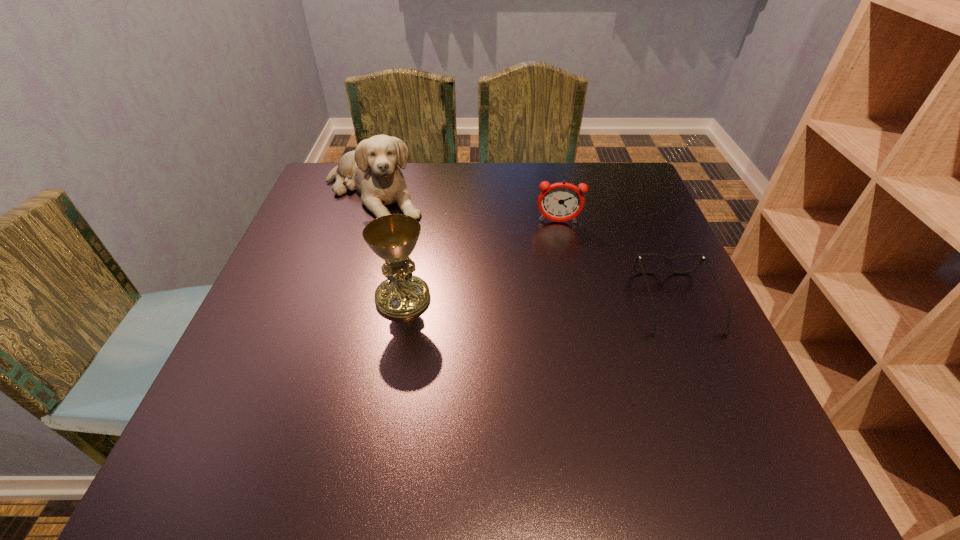
The height and width of the screenshot is (540, 960). I want to click on free space located 0.280m on the front-facing side of the second shortest object, so click(561, 310).

Identify the location of free space located 0.110m on the front-facing side of the puppy. The height and width of the screenshot is (540, 960). (429, 240).

In order to click on vacant space located on the front-facing side of the puppy in this screenshot , I will do `click(462, 266)`.

I want to click on free space located on the front-facing side of the puppy, so click(x=456, y=261).

What are the coordinates of `object located at the far edge` in the screenshot? It's located at (373, 168).

Locate an element on the screen. The height and width of the screenshot is (540, 960). object that is at the left edge is located at coordinates (373, 168).

Where is `object located at the right edge`? The image size is (960, 540). object located at the right edge is located at coordinates (669, 260).

At what (x,y) coordinates should I click in order to perform the action: click on object present at the far left corner. Please return your answer as a coordinate pair (x, y). The height and width of the screenshot is (540, 960). Looking at the image, I should click on (373, 168).

Locate an element on the screen. free space at the far edge of the desktop is located at coordinates (492, 206).

At what (x,y) coordinates should I click in order to perform the action: click on free location at the near edge. Please return your answer as a coordinate pair (x, y). The image size is (960, 540). Looking at the image, I should click on (513, 377).